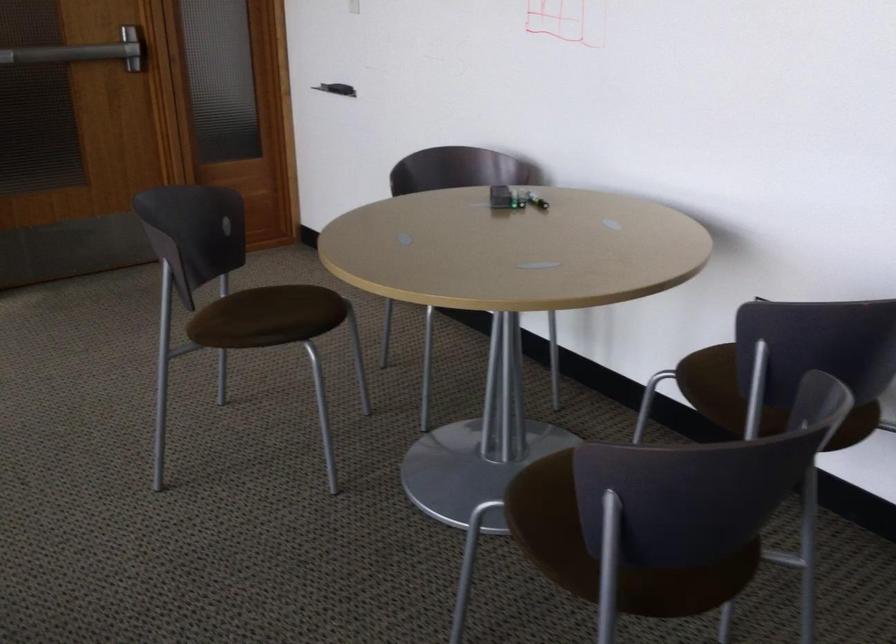
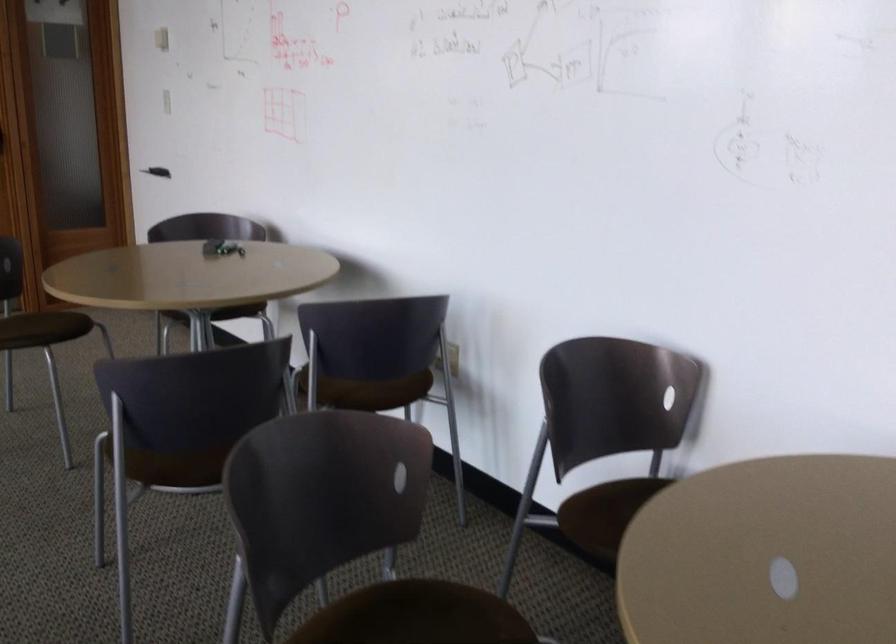
In a continuous first-person perspective shot, in which direction is the camera moving?

The cameraman moved toward right, backward.